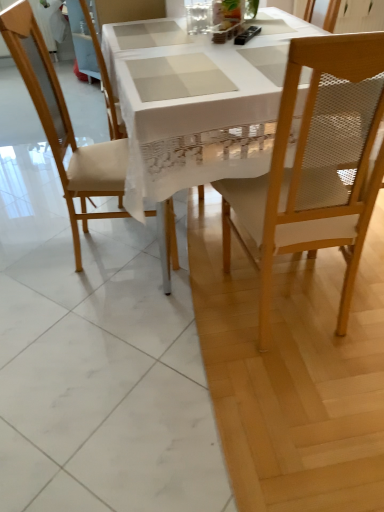
Identify the location of free point below matte wood chair at left, placed as the 3th chair when sorted from right to left (from a real-world perspective). This screenshot has height=512, width=384. (108, 246).